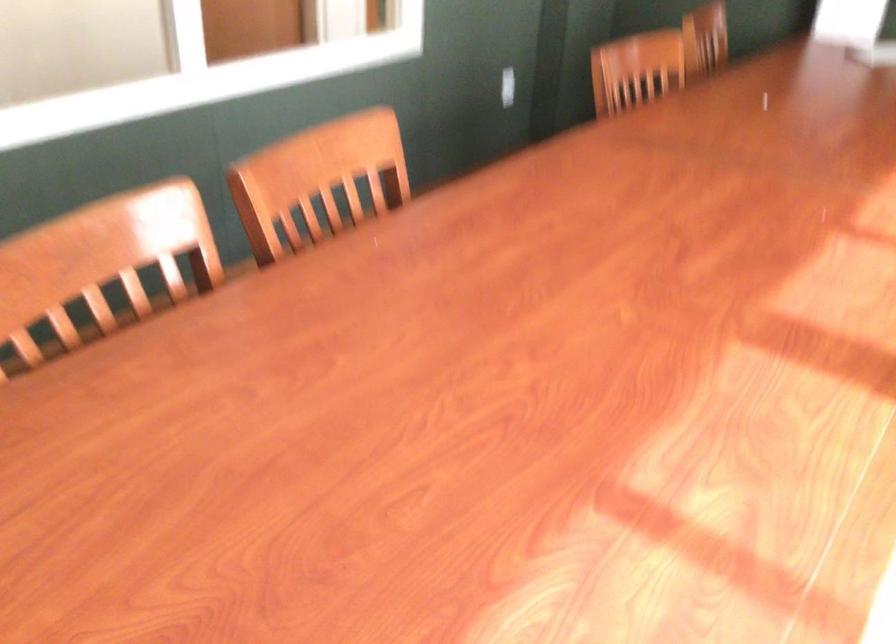
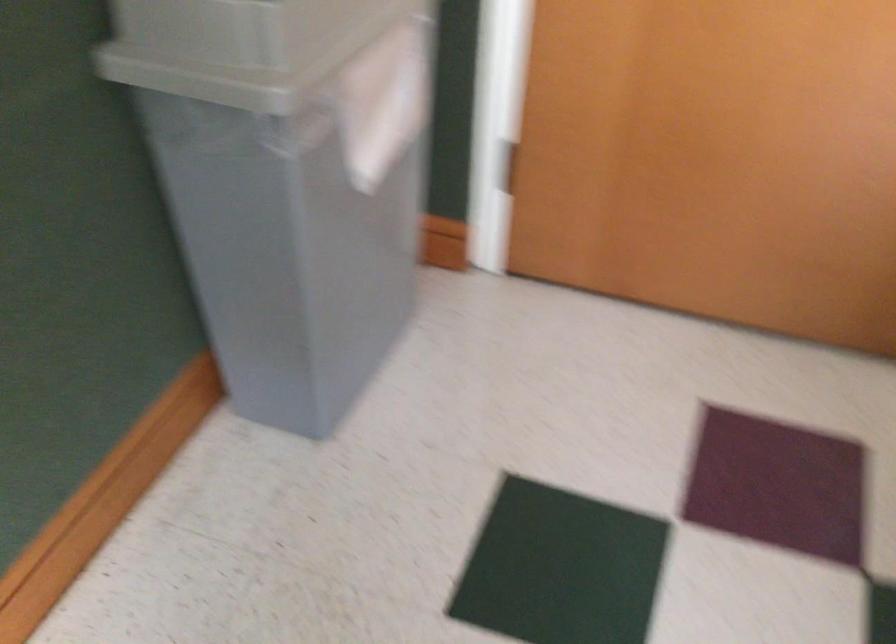
Based on the continuous images, in which direction is the camera rotating?

The camera's rotation is toward left-down.